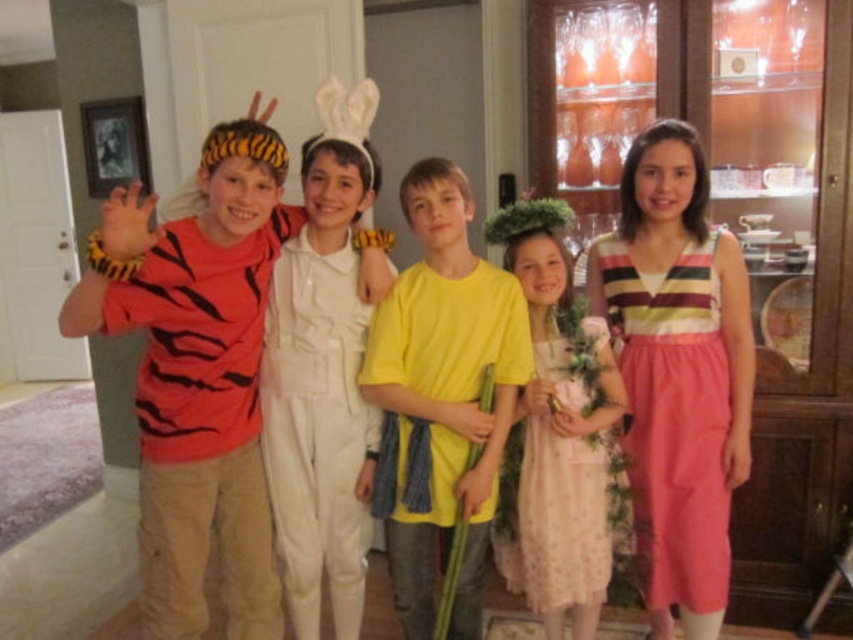
You are standing in the room and see the point at coordinates (x=202, y=422). What object is this point located on?

The point at coordinates (x=202, y=422) is located on the tiger striped fabric shirt at left.